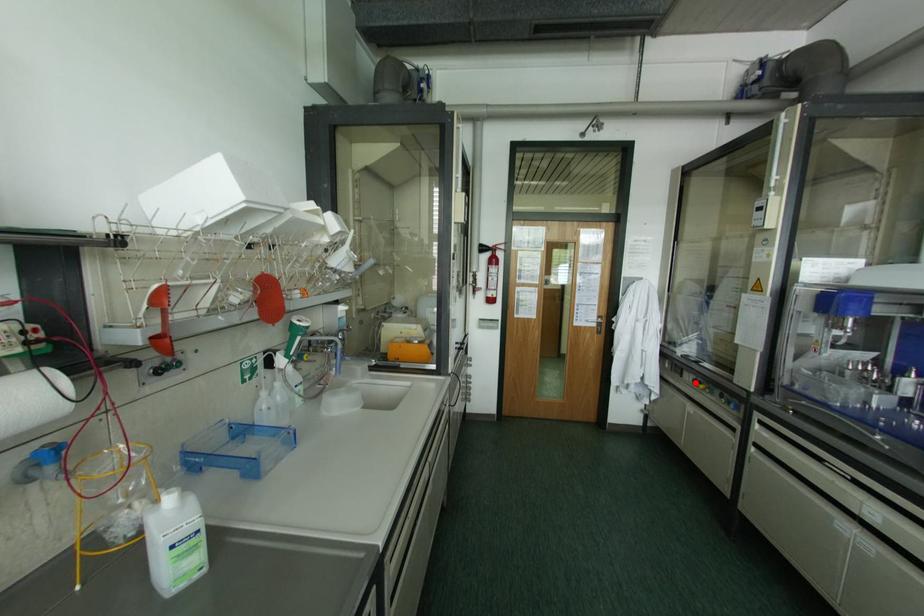
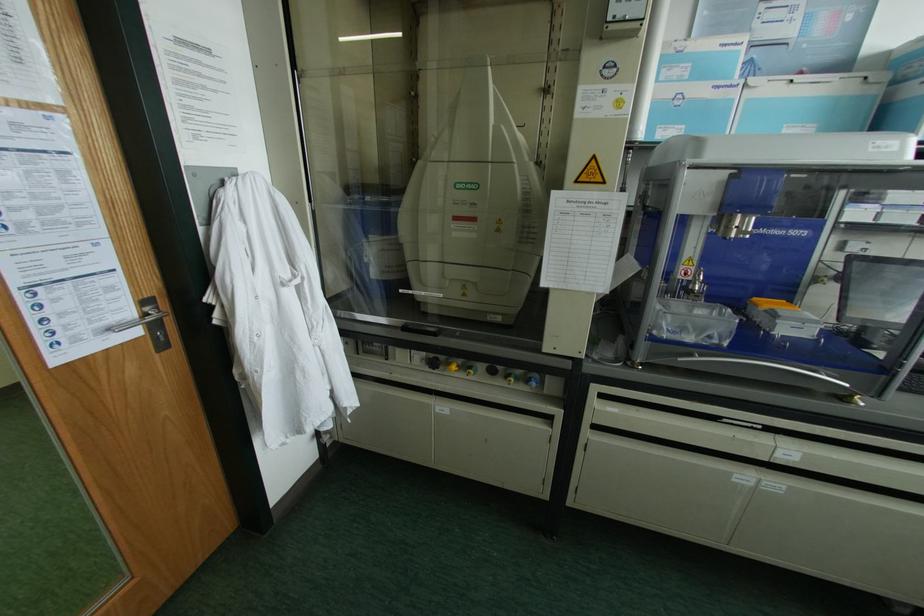
Where in the second image is the point corresponding to the highlighted location from the first image?

(432, 363)